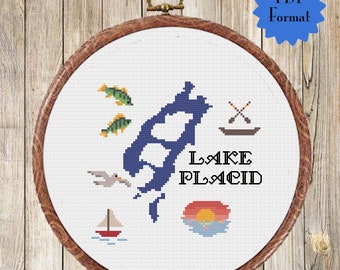
The width and height of the screenshot is (340, 270). In order to click on wall in this screenshot , I will do `click(40, 75)`.